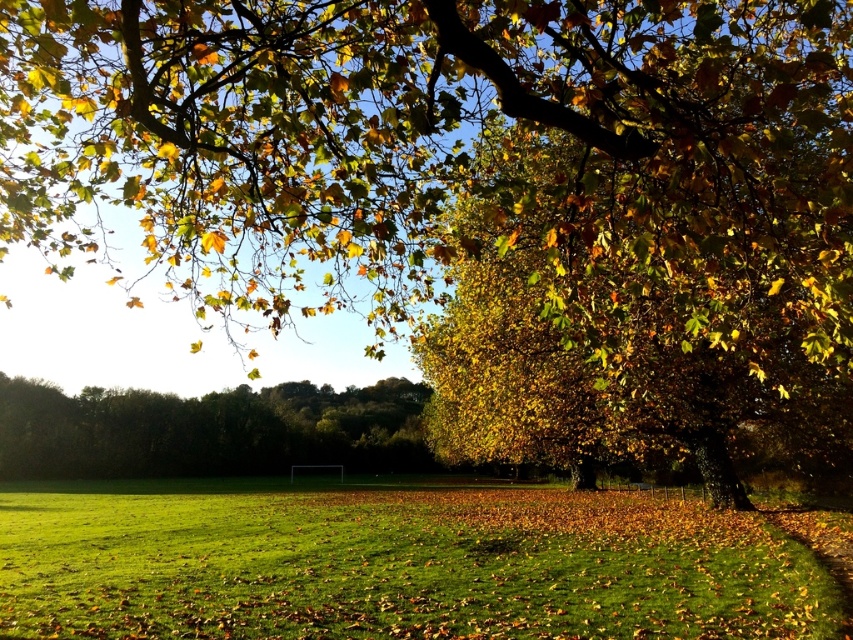
Question: Which object is closer to the camera taking this photo?

Choices:
 (A) green grassy field at center
 (B) green leafy tree at center

Answer: (A)

Question: Can you confirm if green grassy field at center is positioned to the left of green leafy tree at center?

Choices:
 (A) yes
 (B) no

Answer: (B)

Question: Is green grassy field at center smaller than green leafy tree at center?

Choices:
 (A) no
 (B) yes

Answer: (A)

Question: Which point appears farthest from the camera in this image?

Choices:
 (A) (395, 424)
 (B) (107, 577)

Answer: (A)

Question: Is green grassy field at center positioned in front of green leafy tree at center?

Choices:
 (A) yes
 (B) no

Answer: (A)